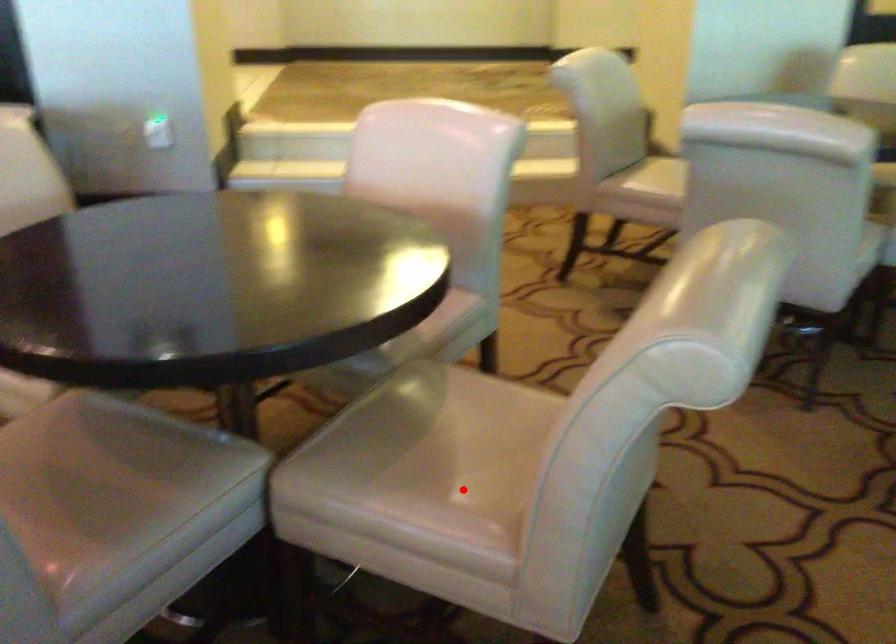
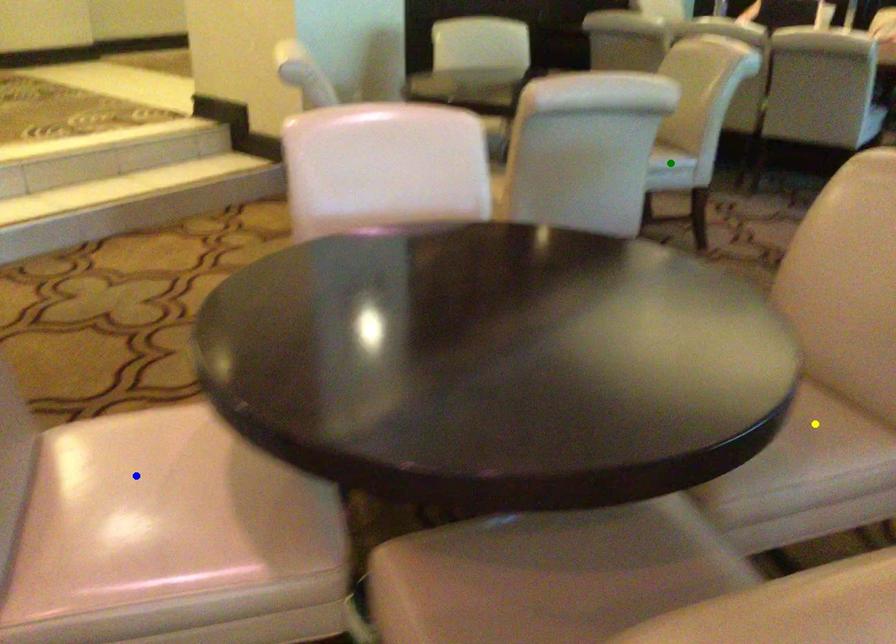
Question: I am providing you with two images of the same scene from different viewpoints. A red point is marked on the first image. You are given multiple points on the second image. In image 2, which mark is for the same physical point as the one in image 1?

Choices:
 (A) blue point
 (B) green point
 (C) yellow point

Answer: (C)